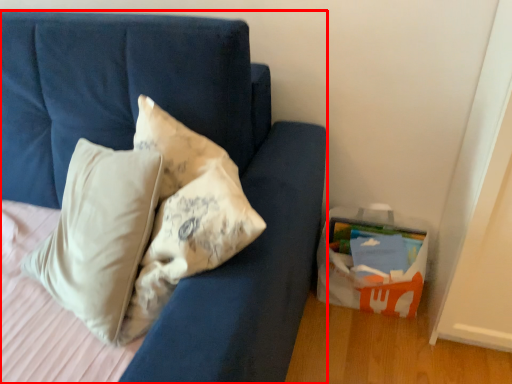
Question: From the image's perspective, what is the correct spatial positioning of furniture (annotated by the red box) in reference to cardboard box?

Choices:
 (A) below
 (B) above

Answer: (B)